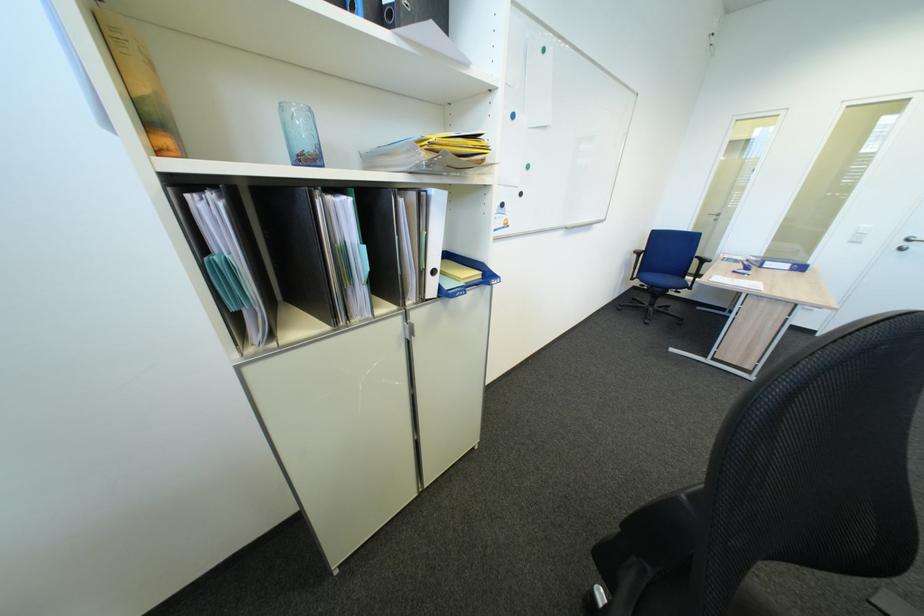
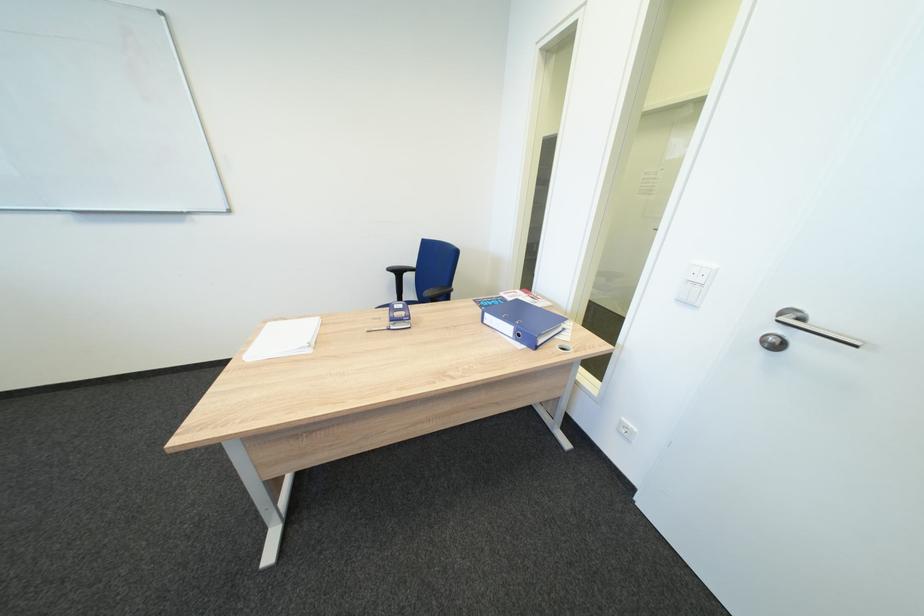
In a continuous first-person perspective shot, in which direction is the camera moving?

The cameraman walked toward right, forward.